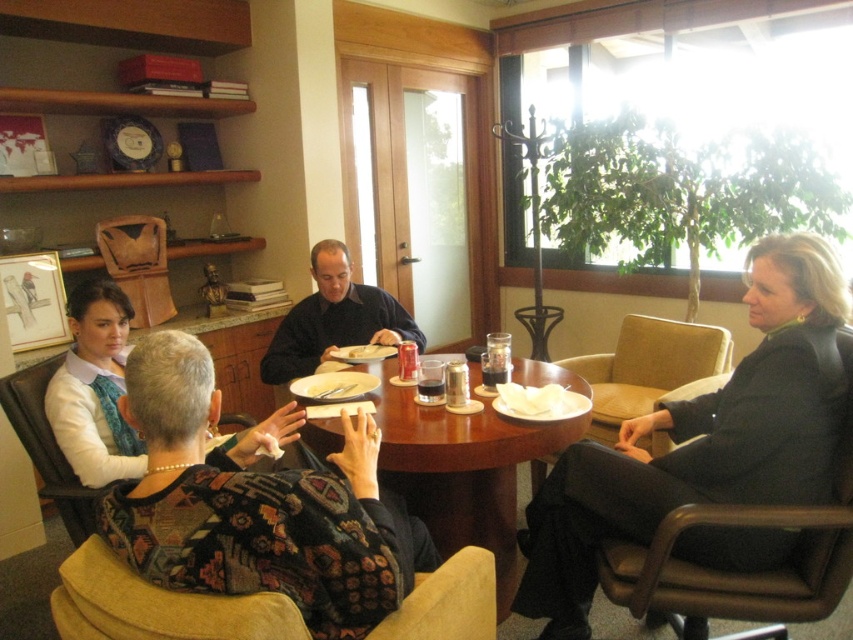
Who is positioned more to the right, white silk blouse at upper left or translucent plastic cup at center?

translucent plastic cup at center

Is white silk blouse at upper left positioned behind translucent plastic cup at center?

No, it is in front of translucent plastic cup at center.

Locate an element on the screen. The height and width of the screenshot is (640, 853). white silk blouse at upper left is located at coordinates (96, 388).

Between black leather jacket at right and leather armchair at right, which one appears on the right side from the viewer's perspective?

Positioned to the right is leather armchair at right.

Can you confirm if black leather jacket at right is shorter than leather armchair at right?

No, black leather jacket at right is not shorter than leather armchair at right.

Between point (543, 488) and point (560, 360), which one is positioned behind?

Point (560, 360)

Find the location of a particular element. The width and height of the screenshot is (853, 640). black leather jacket at right is located at coordinates (703, 438).

Looking at this image, can you confirm if velvet floral-patterned armchair at lower center is positioned below leather armchair at right?

Correct, velvet floral-patterned armchair at lower center is located below leather armchair at right.

How much distance is there between velvet floral-patterned armchair at lower center and leather armchair at right?

velvet floral-patterned armchair at lower center and leather armchair at right are 5.71 feet apart from each other.

Is point (128, 632) less distant than point (688, 330)?

Yes, point (128, 632) is closer to viewer.

Locate an element on the screen. velvet floral-patterned armchair at lower center is located at coordinates (157, 605).